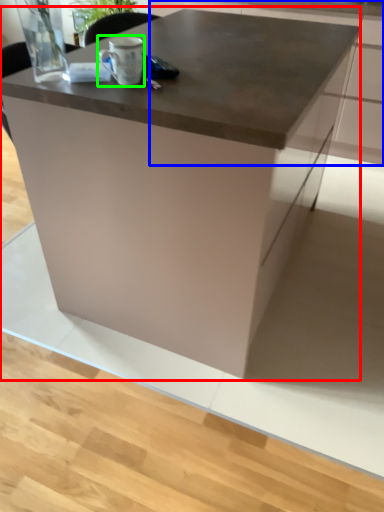
Question: Which object is positioned farthest from table (highlighted by a red box)? Select from cabinetry (highlighted by a blue box) and coffee cup (highlighted by a green box).

Choices:
 (A) cabinetry
 (B) coffee cup

Answer: (A)